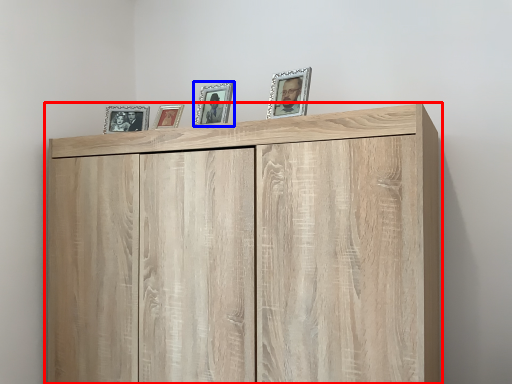
Question: Which object appears closest to the camera in this image, cupboard (highlighted by a red box) or picture frame (highlighted by a blue box)?

Choices:
 (A) cupboard
 (B) picture frame

Answer: (A)